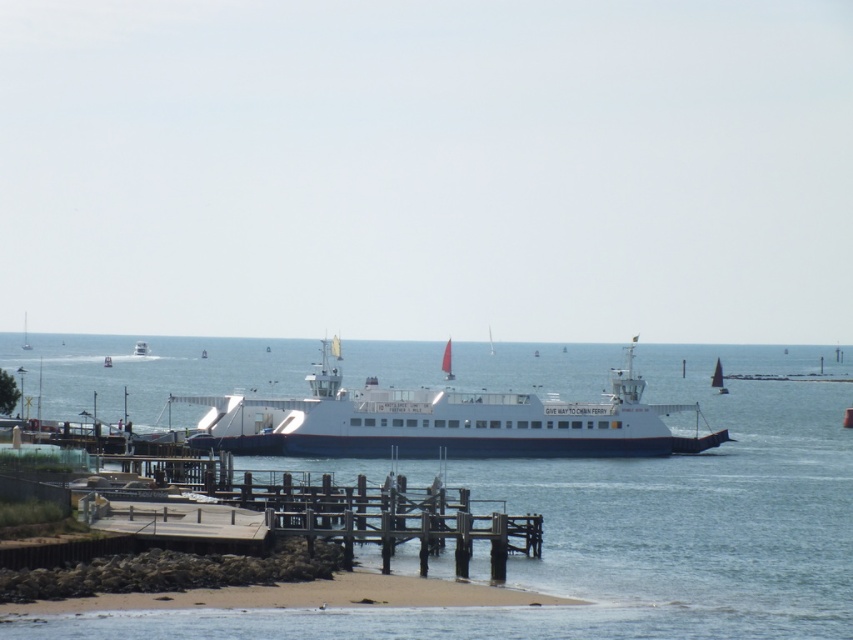
You are standing on the pier looking at the ferry. There are two points marked on the ferry boat. Which point is closer to you, point at coordinates (247, 433) or point at coordinates (140, 348)?

Point at coordinates (247, 433) is closer to the viewer than point at coordinates (140, 348).